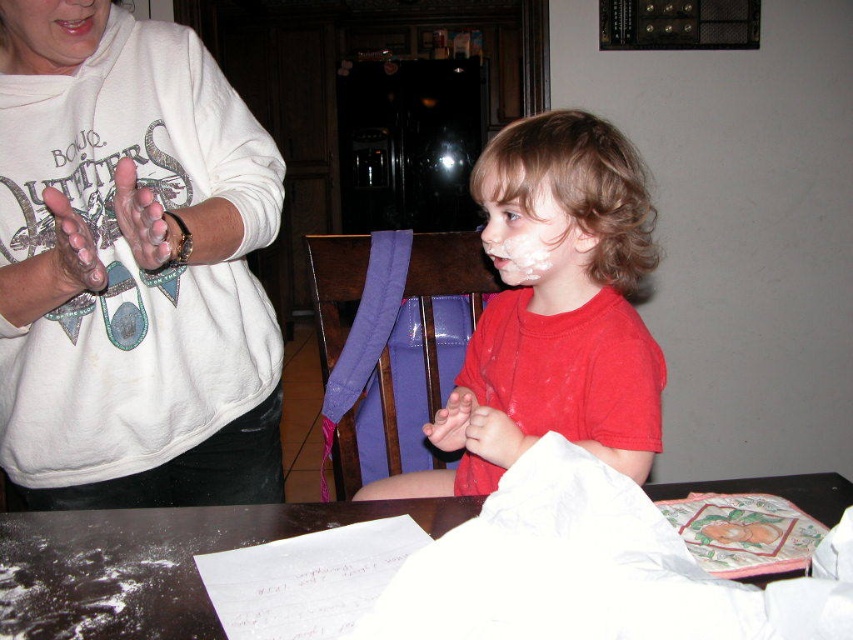
Can you confirm if matte red shirt at center is taller than white matte face at center?

Yes, matte red shirt at center is taller than white matte face at center.

Between point (548, 259) and point (549, 212), which one is positioned in front?

Point (549, 212) is in front.

Where is `matte red shirt at center`? This screenshot has width=853, height=640. matte red shirt at center is located at coordinates (553, 310).

Is point (112, 468) behind point (521, 259)?

No, (112, 468) is closer to viewer.

Is point (213, 256) less distant than point (502, 172)?

Yes, point (213, 256) is closer to viewer.

This screenshot has width=853, height=640. Identify the location of white matte sweatshirt at upper left. (136, 280).

Looking at this image, does white matte table at lower center appear under smooth skin at upper left?

Indeed, white matte table at lower center is positioned under smooth skin at upper left.

Is point (799, 496) positioned before point (86, 3)?

That is False.

The image size is (853, 640). What are the coordinates of `white matte table at lower center` in the screenshot? It's located at (154, 563).